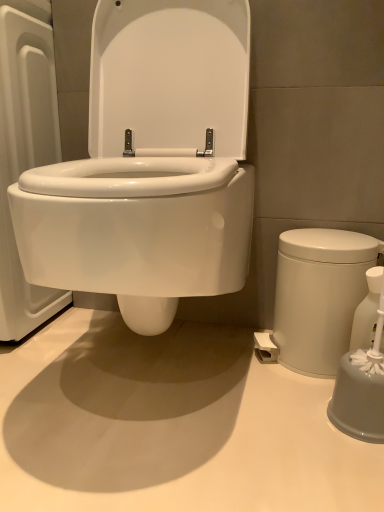
Question: Is white glossy soap dispenser at right wider or thinner than white glossy trash can at right?

Choices:
 (A) wide
 (B) thin

Answer: (B)

Question: Is point (352, 338) positioned closer to the camera than point (296, 342)?

Choices:
 (A) closer
 (B) farther

Answer: (A)

Question: Is white glossy soap dispenser at right inside the boundaries of white glossy trash can at right, or outside?

Choices:
 (A) inside
 (B) outside

Answer: (A)

Question: Do you think white glossy trash can at right is within white glossy soap dispenser at right, or outside of it?

Choices:
 (A) inside
 (B) outside

Answer: (B)

Question: Is white glossy trash can at right to the left or to the right of white glossy soap dispenser at right in the image?

Choices:
 (A) right
 (B) left

Answer: (B)

Question: From a real-world perspective, is white glossy trash can at right above or below white glossy soap dispenser at right?

Choices:
 (A) above
 (B) below

Answer: (A)

Question: Is white glossy trash can at right taller or shorter than white glossy soap dispenser at right?

Choices:
 (A) tall
 (B) short

Answer: (A)